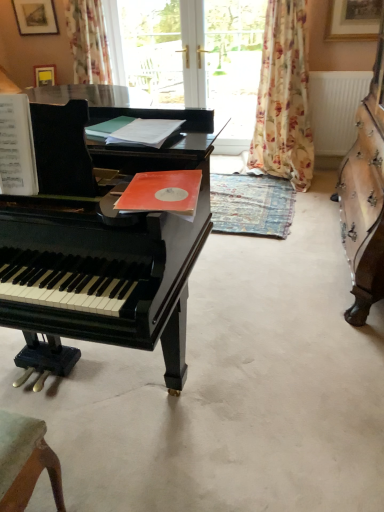
What is the approximate height of floral fabric curtain at center, which is the 1th curtain in right-to-left order?

floral fabric curtain at center, which is the 1th curtain in right-to-left order, is 1.48 meters tall.

Identify the location of glossy black piano at left. (97, 251).

The image size is (384, 512). Find the location of `transparent glass door at center, marked as the 2th window screen in a left-to-right arrangement`. transparent glass door at center, marked as the 2th window screen in a left-to-right arrangement is located at coordinates 233,68.

The width and height of the screenshot is (384, 512). In order to click on black piano at left in this screenshot , I will do `click(231, 388)`.

Can you confirm if matte black harpsichord at center is bigger than white plastic radiator at upper right?

Yes, matte black harpsichord at center is bigger than white plastic radiator at upper right.

Can you tell me how much matte black harpsichord at center and white plastic radiator at upper right differ in facing direction?

The angular difference between matte black harpsichord at center and white plastic radiator at upper right is 89.6 degrees.

Locate an element on the screen. This screenshot has height=512, width=384. radiator that is behind the matte black harpsichord at center is located at coordinates (335, 108).

Which object is positioned more to the right, matte black harpsichord at center or white plastic radiator at upper right?

white plastic radiator at upper right.

Can you confirm if black piano at left is thinner than matte black harpsichord at center?

Incorrect, the width of black piano at left is not less than that of matte black harpsichord at center.

Are black piano at left and matte black harpsichord at center located far from each other?

No, there isn't a large distance between black piano at left and matte black harpsichord at center.

From a real-world perspective, which object rests below the other?

black piano at left.

From the picture: Considering the relative positions of black piano at left and matte black harpsichord at center in the image provided, is black piano at left to the left of matte black harpsichord at center from the viewer's perspective?

Indeed, black piano at left is positioned on the left side of matte black harpsichord at center.

Which is behind, point (181, 54) or point (237, 139)?

The point (237, 139) is more distant.

From a real-world perspective, is transparent glass door at upper center, which is the first window screen in left-to-right order, on top of transparent glass door at center, marked as the 2th window screen in a left-to-right arrangement?

Yes, from a real-world perspective, transparent glass door at upper center, which is the first window screen in left-to-right order, is on top of transparent glass door at center, marked as the 2th window screen in a left-to-right arrangement.

How many degrees apart are the facing directions of transparent glass door at upper center, which is the first window screen in left-to-right order, and matte black harpsichord at center?

They differ by 88.9 degrees in their facing directions.

Is transparent glass door at upper center, the second window screen when ordered from right to left, smaller than matte black harpsichord at center?

Yes, transparent glass door at upper center, the second window screen when ordered from right to left, is smaller than matte black harpsichord at center.

I want to click on the 2nd window screen behind when counting from the matte black harpsichord at center, so click(153, 49).

Is transparent glass door at upper center, the second window screen when ordered from right to left, far from matte black harpsichord at center?

Yes, transparent glass door at upper center, the second window screen when ordered from right to left, is far from matte black harpsichord at center.

Is floral fabric curtain at center, which is the 1th curtain in right-to-left order, inside or outside of matte black harpsichord at center?

floral fabric curtain at center, which is the 1th curtain in right-to-left order, is located beyond the bounds of matte black harpsichord at center.

Is point (255, 160) positioned after point (371, 274)?

Yes, point (255, 160) is behind point (371, 274).

Is the position of floral fabric curtain at center, which ranks as the 2th curtain in left-to-right order, less distant than that of matte black harpsichord at center?

No, floral fabric curtain at center, which ranks as the 2th curtain in left-to-right order, is further to the viewer.

Where is `window screen that is the 1st object located behind the white plastic radiator at upper right`? window screen that is the 1st object located behind the white plastic radiator at upper right is located at coordinates (233, 68).

Is white plastic radiator at upper right located within transparent glass door at center, marked as the 2th window screen in a left-to-right arrangement?

No, white plastic radiator at upper right is not inside transparent glass door at center, marked as the 2th window screen in a left-to-right arrangement.

Could you tell me if transparent glass door at center, marked as the 1th window screen in a right-to-left arrangement, is facing white plastic radiator at upper right?

No, transparent glass door at center, marked as the 1th window screen in a right-to-left arrangement, does not turn towards white plastic radiator at upper right.

Which is in front, point (226, 85) or point (361, 85)?

The point (361, 85) is in front.

Is glossy black piano at left surrounded by transparent glass door at center, marked as the 2th window screen in a left-to-right arrangement?

No, glossy black piano at left is not surrounded by transparent glass door at center, marked as the 2th window screen in a left-to-right arrangement.

Is transparent glass door at center, marked as the 2th window screen in a left-to-right arrangement, positioned behind glossy black piano at left?

Yes, it is behind glossy black piano at left.

Who is shorter, transparent glass door at center, marked as the 1th window screen in a right-to-left arrangement, or glossy black piano at left?

glossy black piano at left is shorter.

Is transparent glass door at center, marked as the 1th window screen in a right-to-left arrangement, to the left of glossy black piano at left from the viewer's perspective?

Incorrect, transparent glass door at center, marked as the 1th window screen in a right-to-left arrangement, is not on the left side of glossy black piano at left.

You are a GUI agent. You are given a task and a screenshot of the screen. Output one action in this format:
    pyautogui.click(x=<x>, y=<y>)
    Task: Click on the harpsichord lying on the left of white plastic radiator at upper right
    The width and height of the screenshot is (384, 512).
    Given the screenshot: What is the action you would take?
    (365, 197)

I want to click on harpsichord behind the black piano at left, so click(365, 197).

Looking at this image, based on their spatial positions, is white plastic radiator at upper right or transparent glass door at upper center, which is the first window screen in left-to-right order, closer to black piano at left?

Among the two, white plastic radiator at upper right is located nearer to black piano at left.

Which object lies further to the anchor point matte black harpsichord at center, glossy black piano at left or floral fabric curtain at center, which is the 1th curtain in right-to-left order?

glossy black piano at left lies further to matte black harpsichord at center than the other object.

From the image, which object appears to be nearer to transparent glass door at center, marked as the 1th window screen in a right-to-left arrangement, black piano at left or matte black harpsichord at center?

matte black harpsichord at center is positioned closer to the anchor transparent glass door at center, marked as the 1th window screen in a right-to-left arrangement.

Which object lies further to the anchor point floral fabric curtain at upper left, positioned as the second curtain in right-to-left order, black piano at left or matte black harpsichord at center?

Based on the image, black piano at left appears to be further to floral fabric curtain at upper left, positioned as the second curtain in right-to-left order.

Which object lies nearer to the anchor point transparent glass door at center, marked as the 1th window screen in a right-to-left arrangement, black piano at left or floral fabric curtain at center, which ranks as the 2th curtain in left-to-right order?

floral fabric curtain at center, which ranks as the 2th curtain in left-to-right order.

From the image, which object appears to be farther from white plastic radiator at upper right, black piano at left or floral fabric curtain at upper left, which ranks as the 1th curtain in left-to-right order?

The object further to white plastic radiator at upper right is black piano at left.

Based on their spatial positions, is black piano at left or floral fabric curtain at center, which is the 1th curtain in right-to-left order, closer to white plastic radiator at upper right?

floral fabric curtain at center, which is the 1th curtain in right-to-left order.

Which object lies further to the anchor point transparent glass door at upper center, the second window screen when ordered from right to left, black piano at left or glossy black piano at left?

Based on the image, black piano at left appears to be further to transparent glass door at upper center, the second window screen when ordered from right to left.

At what (x,y) coordinates should I click in order to perform the action: click on window screen positioned between black piano at left and transparent glass door at upper center, the second window screen when ordered from right to left, from near to far. Please return your answer as a coordinate pair (x, y). The width and height of the screenshot is (384, 512). Looking at the image, I should click on (233, 68).

I want to click on concrete between glossy black piano at left and transparent glass door at center, marked as the 2th window screen in a left-to-right arrangement, in the front-back direction, so click(x=231, y=388).

Locate an element on the screen. radiator between black piano at left and transparent glass door at center, marked as the 1th window screen in a right-to-left arrangement, along the z-axis is located at coordinates click(335, 108).

The width and height of the screenshot is (384, 512). What are the coordinates of `concrete positioned between glossy black piano at left and floral fabric curtain at upper left, positioned as the second curtain in right-to-left order, from near to far` in the screenshot? It's located at (231, 388).